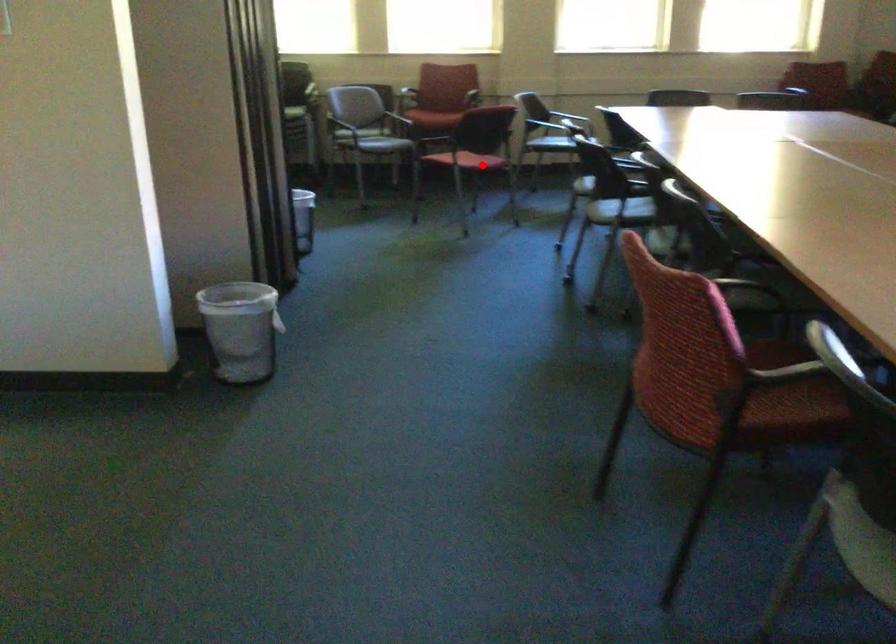
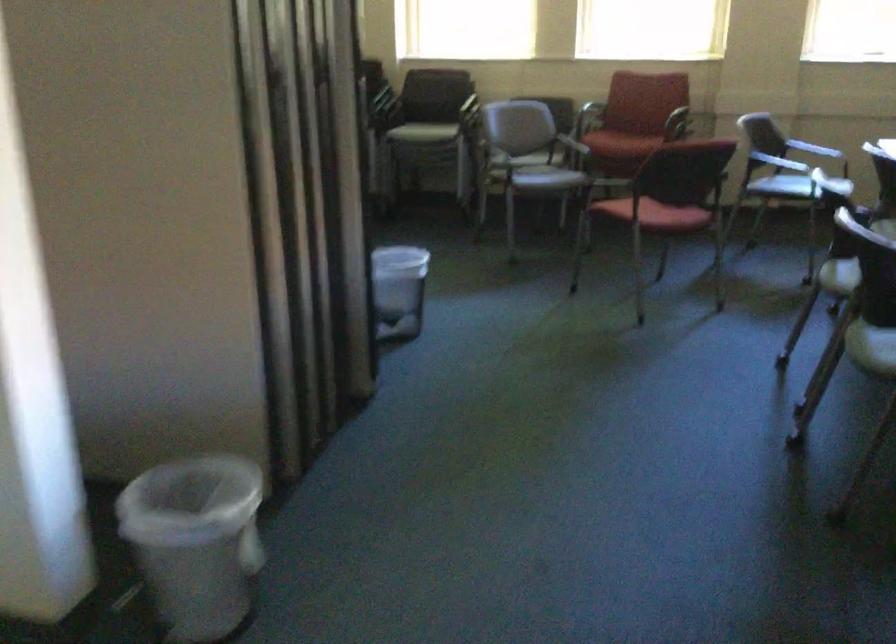
Find the pixel in the second image that matches the highlighted location in the first image.

(660, 214)